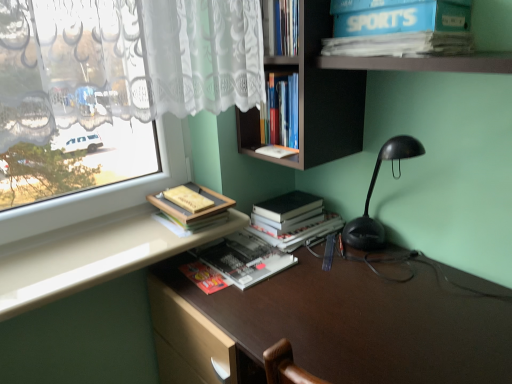
Where is `vacant area that lies in front of hardcover book at center, marked as the fourth book in a top-to-bottom arrangement`? The image size is (512, 384). vacant area that lies in front of hardcover book at center, marked as the fourth book in a top-to-bottom arrangement is located at coordinates (253, 318).